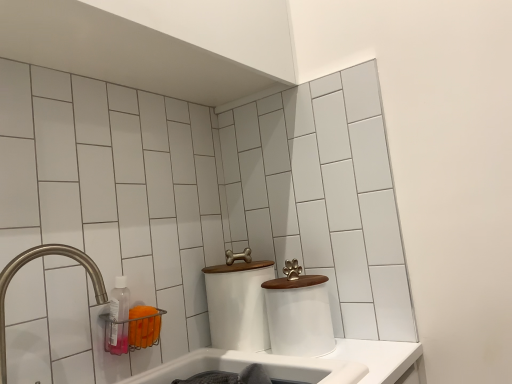
Question: In terms of width, does white plastic bath at lower center look wider or thinner when compared to transparent plastic bottle at lower left?

Choices:
 (A) thin
 (B) wide

Answer: (B)

Question: From their relative heights in the image, would you say white plastic bath at lower center is taller or shorter than transparent plastic bottle at lower left?

Choices:
 (A) tall
 (B) short

Answer: (B)

Question: Estimate the real-world distances between objects in this image. Which object is closer to the white matte toilet paper at center, which is counted as the 2th toilet paper, starting from the left?

Choices:
 (A) white plastic bath at lower center
 (B) white matte toilet paper at center, the second toilet paper from the right
 (C) brushed metal faucet at left
 (D) transparent plastic bottle at lower left

Answer: (B)

Question: Based on their relative distances, which object is farther from the white matte toilet paper at center, placed as the first toilet paper when sorted from left to right?

Choices:
 (A) transparent plastic bottle at lower left
 (B) brushed metal faucet at left
 (C) white matte toilet paper at center, the 1th toilet paper in the right-to-left sequence
 (D) white plastic bath at lower center

Answer: (B)